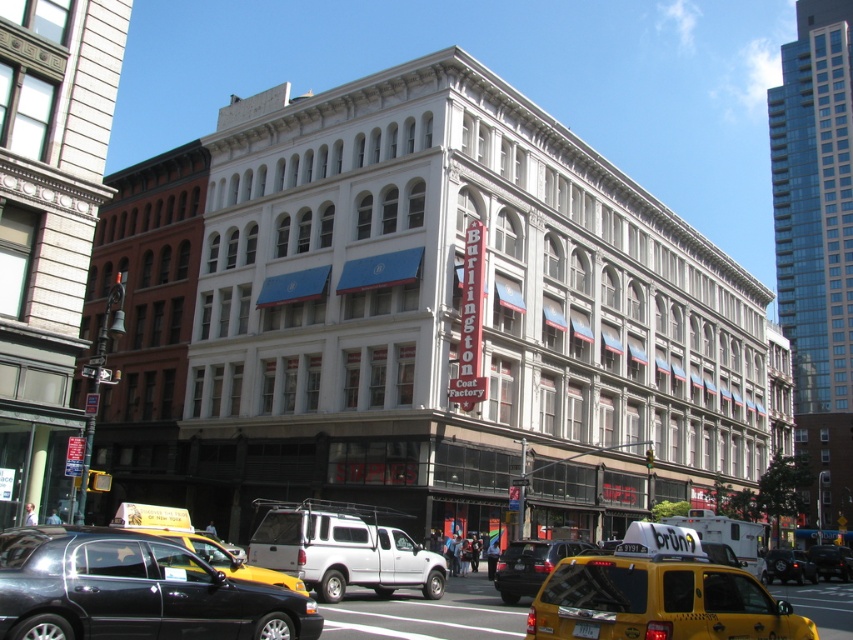
Does black glossy sedan at lower left appear under yellow rubber taxi at lower right?

Actually, black glossy sedan at lower left is above yellow rubber taxi at lower right.

Can you confirm if black glossy sedan at lower left is smaller than yellow rubber taxi at lower right?

Correct, black glossy sedan at lower left occupies less space than yellow rubber taxi at lower right.

Between point (146, 628) and point (636, 582), which one is positioned in front?

Positioned in front is point (636, 582).

Find the location of a particular element. The height and width of the screenshot is (640, 853). black glossy sedan at lower left is located at coordinates (132, 589).

Image resolution: width=853 pixels, height=640 pixels. Describe the element at coordinates (196, 541) in the screenshot. I see `yellow rubber taxi cab at lower left` at that location.

Is yellow rubber taxi cab at lower left behind metallic silver van at center?

No, yellow rubber taxi cab at lower left is closer to the viewer.

Where is `yellow rubber taxi cab at lower left`? yellow rubber taxi cab at lower left is located at coordinates (x=196, y=541).

Is yellow rubber taxi at lower right smaller than metallic silver suv at center?

No, yellow rubber taxi at lower right is not smaller than metallic silver suv at center.

Is point (663, 557) farther from camera compared to point (540, 573)?

No, (663, 557) is closer to viewer.

Is point (753, 632) farther from viewer compared to point (538, 568)?

No, (753, 632) is closer to viewer.

Image resolution: width=853 pixels, height=640 pixels. I want to click on yellow rubber taxi at lower right, so click(659, 595).